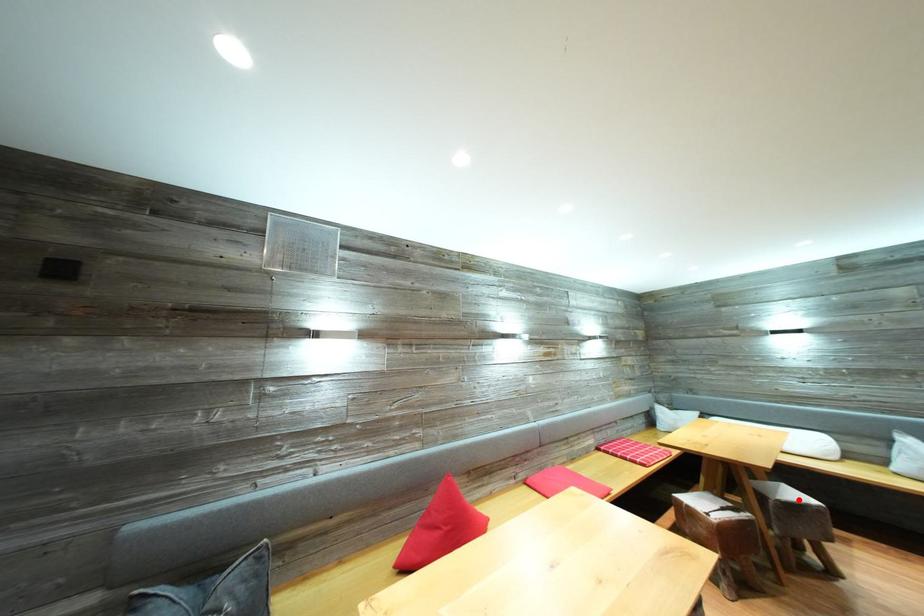
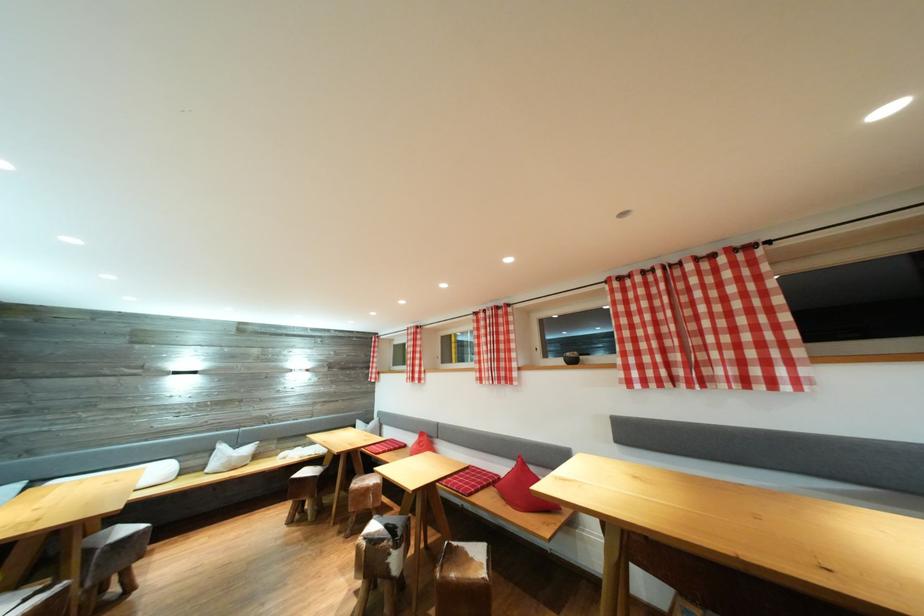
Question: I am providing you with two images of the same scene from different viewpoints. A red point is shown in image1. For the corresponding object point in image2, is it positioned nearer or farther from the camera?

Choices:
 (A) Nearer
 (B) Farther

Answer: (B)